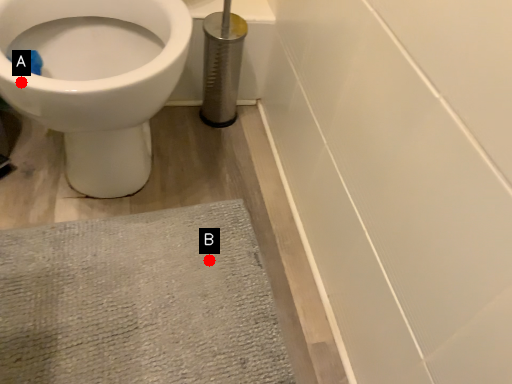
Question: Two points are circled on the image, labeled by A and B beside each circle. Which point is farther from the camera taking this photo?

Choices:
 (A) A is further
 (B) B is further

Answer: (B)